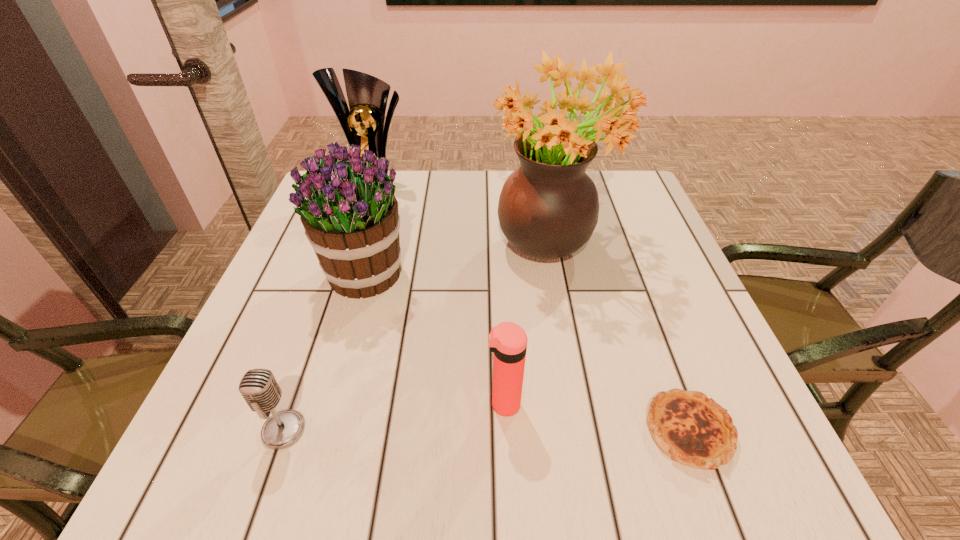
This screenshot has width=960, height=540. What are the coordinates of `flower arrangement` in the screenshot? It's located at (548, 208).

Identify the location of award. (363, 125).

The height and width of the screenshot is (540, 960). What are the coordinates of `bouquet` in the screenshot? It's located at (350, 215).

Locate an element on the screen. The image size is (960, 540). thermos bottle is located at coordinates (508, 341).

Identify the location of the second shortest object. The image size is (960, 540). (259, 388).

Find the location of a particular element. the shortest object is located at coordinates (692, 429).

Locate an element on the screen. vacant space located on the front of the tallest object is located at coordinates (581, 406).

Find the location of `free region located 0.270m at the front of the farthest object, where the globe is visible`. free region located 0.270m at the front of the farthest object, where the globe is visible is located at coordinates (349, 270).

Locate an element on the screen. vacant area located 0.320m on the back of the bouquet is located at coordinates (392, 174).

Find the location of a particular element. This screenshot has width=960, height=540. free spot located on the right of the thermos bottle is located at coordinates (743, 404).